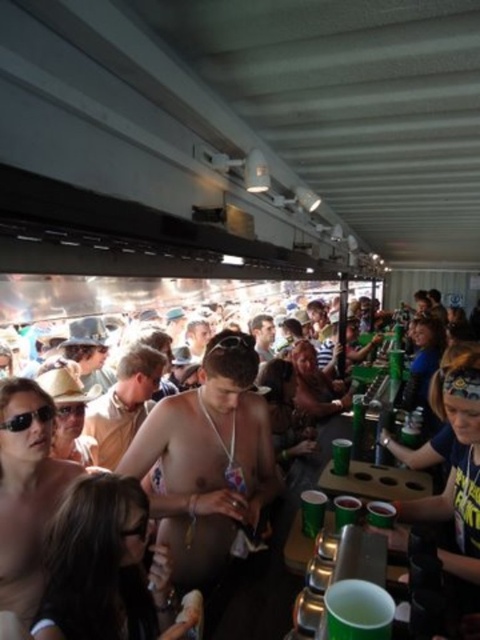
Question: Does nude skin at center appear on the left side of green plastic cup at lower center?

Choices:
 (A) yes
 (B) no

Answer: (A)

Question: Where is nude skin at center located in relation to black plastic sunglasses at center in the image?

Choices:
 (A) above
 (B) below

Answer: (B)

Question: Among these objects, which one is farthest from the camera?

Choices:
 (A) black plastic sunglasses at center
 (B) nude skin at center
 (C) green plastic cup at lower center

Answer: (A)

Question: Which of these objects is positioned closest to the green plastic cup at lower center?

Choices:
 (A) black plastic sunglasses at center
 (B) nude skin at center

Answer: (B)

Question: Among these objects, which one is nearest to the camera?

Choices:
 (A) black plastic sunglasses at center
 (B) green plastic cup at lower center
 (C) nude skin at center

Answer: (B)

Question: Is the position of nude skin at center more distant than that of black plastic sunglasses at center?

Choices:
 (A) yes
 (B) no

Answer: (B)